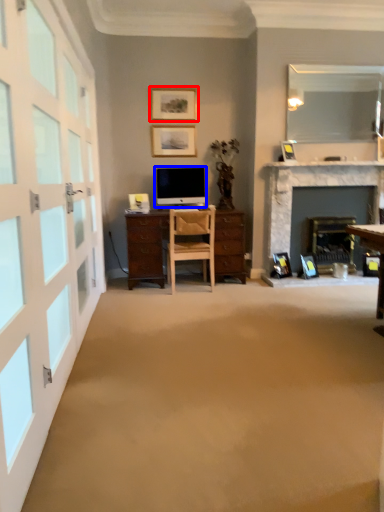
Question: Which of the following is the closest to the observer, picture frame (highlighted by a red box) or television (highlighted by a blue box)?

Choices:
 (A) picture frame
 (B) television

Answer: (B)